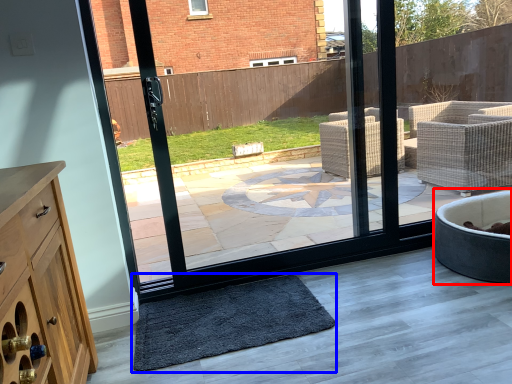
Question: Which of the following is the farthest to the observer, bath (highlighted by a red box) or mat (highlighted by a blue box)?

Choices:
 (A) bath
 (B) mat

Answer: (A)